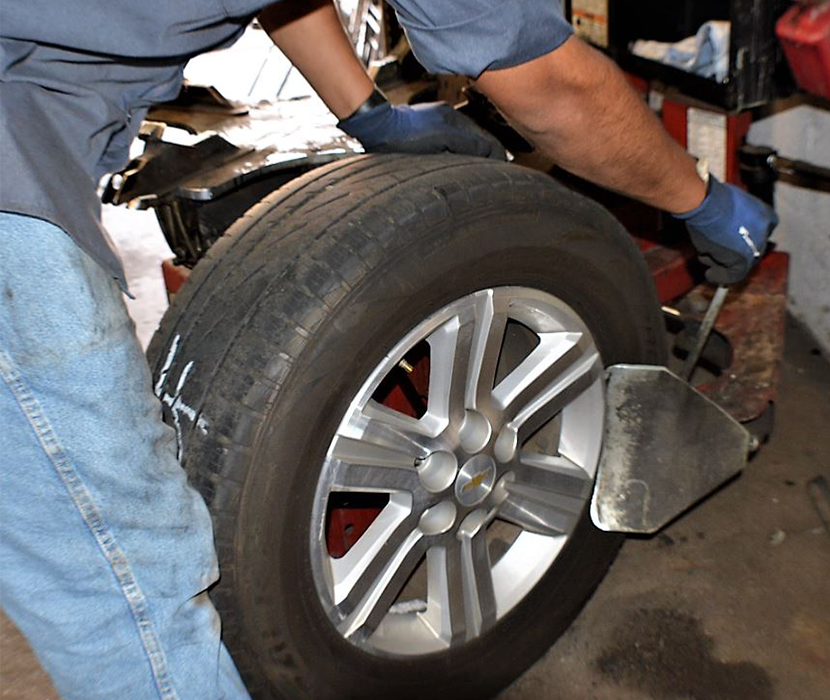
Find the location of a particular element. concrete floor is located at coordinates (695, 554).